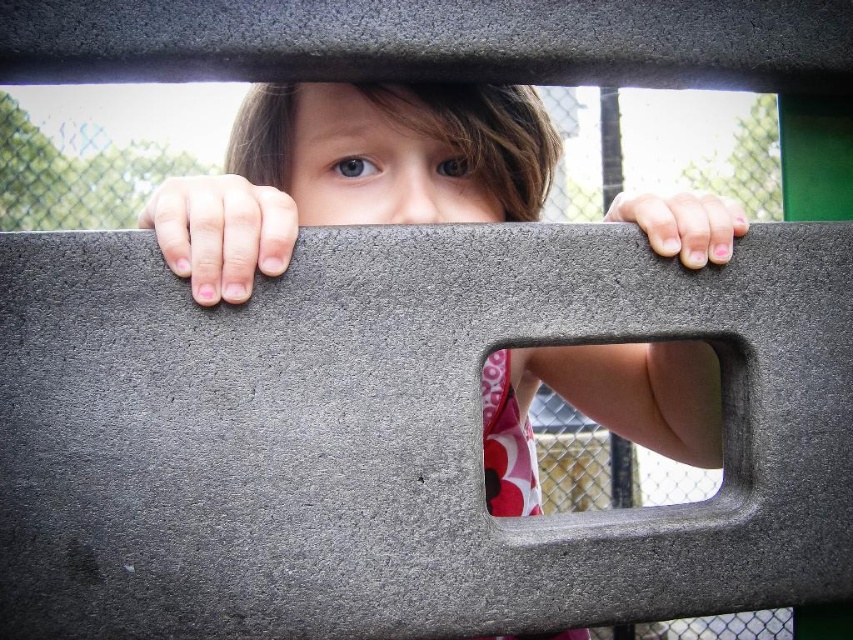
Does matte gray concrete at center appear under pink fabric at center?

No, matte gray concrete at center is not below pink fabric at center.

Between matte gray concrete at center and pink fabric at center, which one appears on the left side from the viewer's perspective?

From the viewer's perspective, matte gray concrete at center appears more on the left side.

Which is in front, point (277, 262) or point (593, 364)?

Point (277, 262) is more forward.

The width and height of the screenshot is (853, 640). In order to click on matte gray concrete at center in this screenshot , I will do `click(351, 172)`.